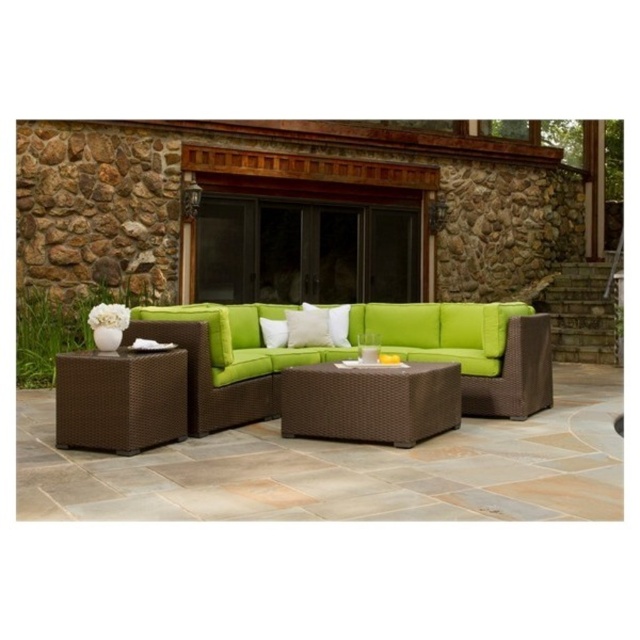
Question: Considering the relative positions of brown wicker side table at lower left and white matte pillow at center in the image provided, where is brown wicker side table at lower left located with respect to white matte pillow at center?

Choices:
 (A) right
 (B) left

Answer: (B)

Question: Does brown wicker coffee table at center come in front of white matte pillow at center?

Choices:
 (A) no
 (B) yes

Answer: (B)

Question: Which point is closer to the camera?

Choices:
 (A) (310, 424)
 (B) (340, 326)
 (C) (266, 307)
 (D) (289, 326)

Answer: (A)

Question: Does brown wicker coffee table at center have a larger size compared to white matte pillow at center?

Choices:
 (A) no
 (B) yes

Answer: (B)

Question: Which point is farther to the camera?

Choices:
 (A) white soft cushion at center
 (B) white matte pillow at center
 (C) green woven couch at center

Answer: (B)

Question: Estimate the real-world distances between objects in this image. Which object is closer to the brown wicker side table at lower left?

Choices:
 (A) white soft cushion at center
 (B) white matte pillow at center

Answer: (A)